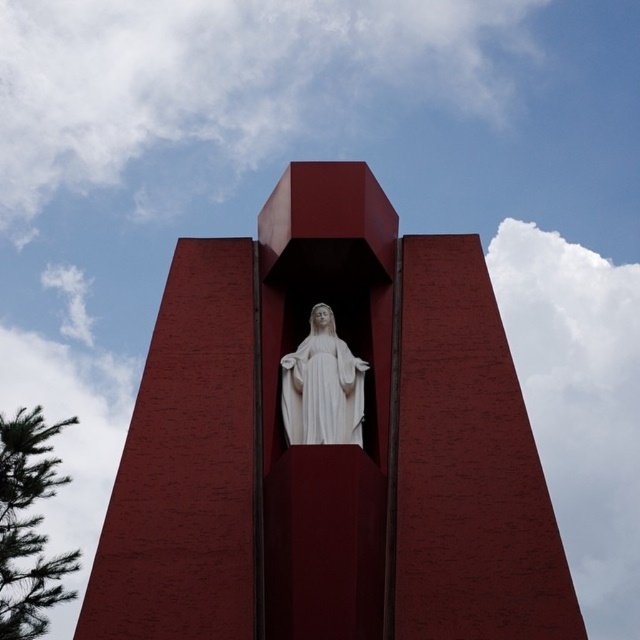
You are standing at a viewpoint and want to take a photo of the matte red tower at center. If your camera can focus on objects up to 50 meters away, will it be able to capture the tower clearly?

The matte red tower at center and camera are 50.94 meters apart from each other, which exceeds the camera maximum focus range of 50 meters. Therefore, the camera cannot capture the tower clearly.

You are standing in front of a large red structure. Where is the matte red tower at center located in the image?

The matte red tower at center is located at the point with coordinates 2D location of matte red tower at center is at point (330, 445).